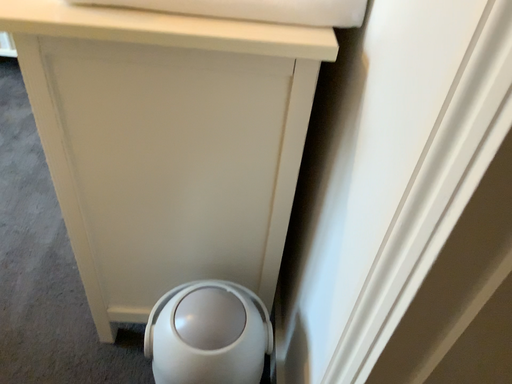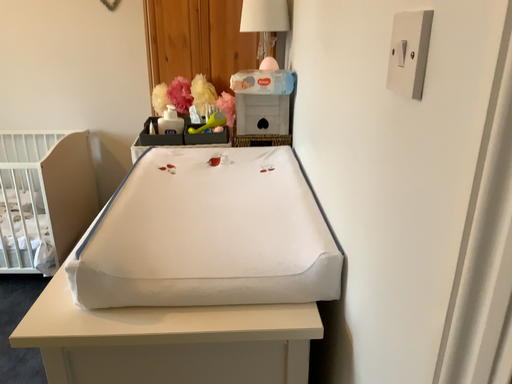
Question: Which way did the camera rotate in the video?

Choices:
 (A) rotated upward
 (B) rotated downward

Answer: (A)